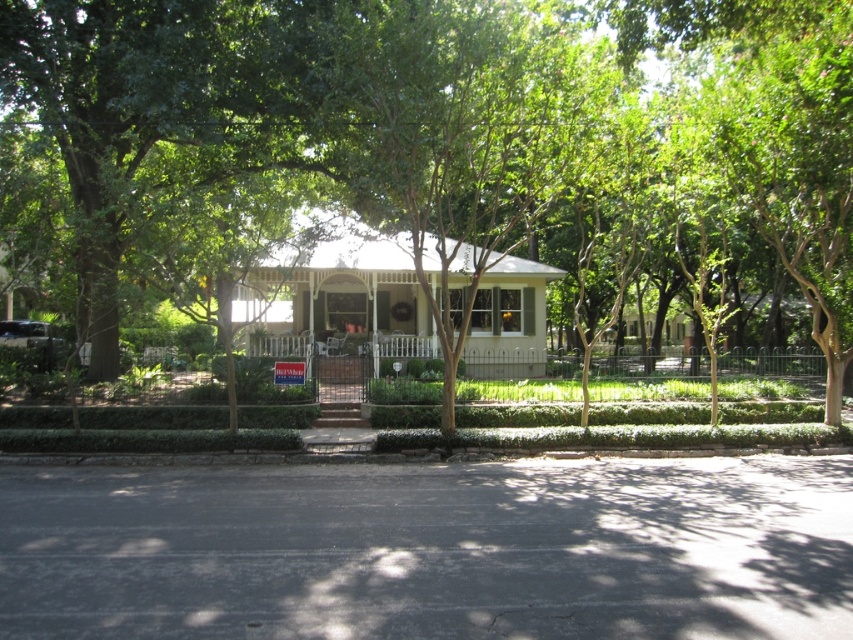
Can you confirm if green leafy tree at center is taller than beige textured gazebo at center?

Yes.

How much distance is there between green leafy tree at center and beige textured gazebo at center?

green leafy tree at center is 3.56 meters away from beige textured gazebo at center.

Looking at this image, who is more distant from viewer, [437,163] or [521,308]?

The point [521,308] is more distant.

Find the location of a particular element. green leafy tree at center is located at coordinates (329, 116).

You are a GUI agent. You are given a task and a screenshot of the screen. Output one action in this format:
    pyautogui.click(x=<x>, y=<y>)
    Task: Click on the beige textured gazebo at center
    Image resolution: width=853 pixels, height=640 pixels.
    Given the screenshot: What is the action you would take?
    pyautogui.click(x=340, y=296)

Which is in front, point (292, 342) or point (409, 269)?

Point (292, 342)

This screenshot has width=853, height=640. I want to click on beige textured gazebo at center, so click(340, 296).

The width and height of the screenshot is (853, 640). I want to click on green leafy tree at center, so click(x=329, y=116).

Is green leafy tree at center bigger than white matte roof at center?

Yes.

Is point (276, 168) positioned behind point (434, 253)?

No, (276, 168) is closer to viewer.

Where is `green leafy tree at center`? Image resolution: width=853 pixels, height=640 pixels. green leafy tree at center is located at coordinates (329, 116).